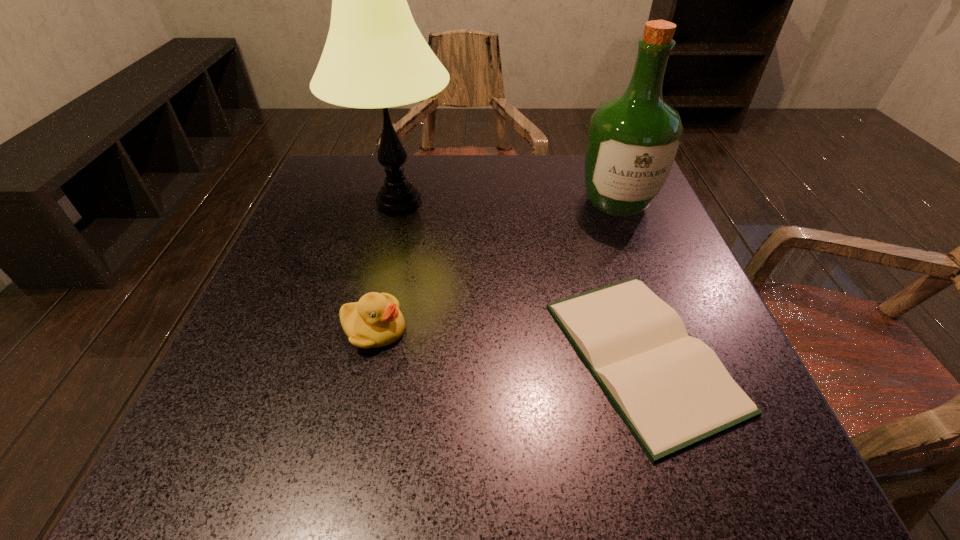
Find the location of a particular element. This screenshot has height=540, width=960. vacant area that lies between the hardback book and the third shortest object is located at coordinates (630, 279).

Where is `free spot between the second shortest object and the lamp`? The width and height of the screenshot is (960, 540). free spot between the second shortest object and the lamp is located at coordinates (387, 266).

At what (x,y) coordinates should I click in order to perform the action: click on vacant area between the duckling and the second tallest object. Please return your answer as a coordinate pair (x, y). This screenshot has width=960, height=540. Looking at the image, I should click on click(x=495, y=266).

Point out which object is positioned as the third nearest to the lamp. Please provide its 2D coordinates. Your answer should be formatted as a tuple, i.e. [(x, y)], where the tuple contains the x and y coordinates of a point satisfying the conditions above.

[(633, 140)]

Locate an element on the screen. This screenshot has height=540, width=960. the closest object relative to the third shortest object is located at coordinates (671, 389).

Where is `free location that satisfies the following two spatial constraints: 1. on the back side of the shortest object; 2. at the face of the duckling`? The width and height of the screenshot is (960, 540). free location that satisfies the following two spatial constraints: 1. on the back side of the shortest object; 2. at the face of the duckling is located at coordinates (634, 329).

At what (x,y) coordinates should I click in order to perform the action: click on blank space that satisfies the following two spatial constraints: 1. on the front-facing side of the liquor; 2. at the face of the duckling. Please return your answer as a coordinate pair (x, y). The image size is (960, 540). Looking at the image, I should click on (x=666, y=329).

Locate an element on the screen. vacant space that satisfies the following two spatial constraints: 1. at the face of the duckling; 2. on the left side of the hardback book is located at coordinates (369, 355).

Where is `vacant region that satisfies the following two spatial constraints: 1. on the front-facing side of the third shortest object; 2. at the face of the third tallest object`? The height and width of the screenshot is (540, 960). vacant region that satisfies the following two spatial constraints: 1. on the front-facing side of the third shortest object; 2. at the face of the third tallest object is located at coordinates (666, 329).